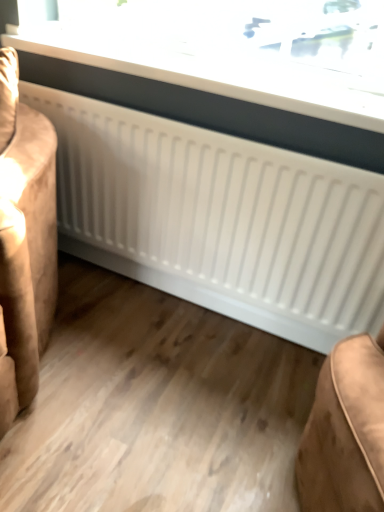
This screenshot has height=512, width=384. What do you see at coordinates (24, 242) in the screenshot?
I see `white matte radiator at lower center` at bounding box center [24, 242].

In order to click on white matte radiator at lower center in this screenshot , I will do `click(24, 242)`.

Measure the distance between point (53,273) and camera.

They are 4.65 feet apart.

Find the location of a particular element. This screenshot has width=384, height=512. white glossy radiator at upper center is located at coordinates (235, 49).

The height and width of the screenshot is (512, 384). What do you see at coordinates (235, 49) in the screenshot?
I see `white glossy radiator at upper center` at bounding box center [235, 49].

This screenshot has width=384, height=512. Identify the location of white matte radiator at lower center. (24, 242).

Which object is positioned more to the right, white matte radiator at lower center or white glossy radiator at upper center?

From the viewer's perspective, white glossy radiator at upper center appears more on the right side.

Is white matte radiator at lower center further to camera compared to white glossy radiator at upper center?

No, it is in front of white glossy radiator at upper center.

Considering the points (17, 329) and (145, 38), which point is in front, point (17, 329) or point (145, 38)?

The point (17, 329) is in front.

Looking at this image, from the image's perspective, which one is positioned higher, white matte radiator at lower center or white glossy radiator at upper center?

white glossy radiator at upper center, from the image's perspective.

From a real-world perspective, is white matte radiator at lower center under white glossy radiator at upper center?

Indeed, from a real-world perspective, white matte radiator at lower center is positioned beneath white glossy radiator at upper center.

Considering the sizes of objects white matte radiator at lower center and white glossy radiator at upper center in the image provided, who is thinner, white matte radiator at lower center or white glossy radiator at upper center?

white glossy radiator at upper center.

From the picture: Considering the relative sizes of white matte radiator at lower center and white glossy radiator at upper center in the image provided, is white matte radiator at lower center taller than white glossy radiator at upper center?

Yes.

In the scene shown: Based on their sizes in the image, would you say white matte radiator at lower center is bigger or smaller than white glossy radiator at upper center?

In the image, white matte radiator at lower center appears to be larger than white glossy radiator at upper center.

Is white matte radiator at lower center positioned beyond the bounds of white glossy radiator at upper center?

That's correct, white matte radiator at lower center is outside of white glossy radiator at upper center.

Can you see white matte radiator at lower center touching white glossy radiator at upper center?

No, white matte radiator at lower center is not in contact with white glossy radiator at upper center.

Is white matte radiator at lower center aimed at white glossy radiator at upper center?

No, white matte radiator at lower center is not aimed at white glossy radiator at upper center.

From the picture: Can you tell me how much white matte radiator at lower center and white glossy radiator at upper center differ in facing direction?

22.2 degrees separate the facing orientations of white matte radiator at lower center and white glossy radiator at upper center.

How distant is white matte radiator at lower center from white glossy radiator at upper center?

white matte radiator at lower center is 25.59 inches from white glossy radiator at upper center.

In the image, there is a white glossy radiator at upper center. Identify the location of furniture below it (from the image's perspective). (24, 242).

Which is more to the left, white glossy radiator at upper center or white matte radiator at lower center?

Positioned to the left is white matte radiator at lower center.

Does white glossy radiator at upper center lie in front of white matte radiator at lower center?

No, it is behind white matte radiator at lower center.

Is point (370, 42) in front of point (33, 368)?

No, (370, 42) is behind (33, 368).

From the image's perspective, which is below, white glossy radiator at upper center or white matte radiator at lower center?

white matte radiator at lower center, from the image's perspective.

From a real-world perspective, is white glossy radiator at upper center located higher than white matte radiator at lower center?

Yes, from a real-world perspective, white glossy radiator at upper center is over white matte radiator at lower center

Does white glossy radiator at upper center have a lesser width compared to white matte radiator at lower center?

Indeed, white glossy radiator at upper center has a lesser width compared to white matte radiator at lower center.

Is white glossy radiator at upper center taller or shorter than white matte radiator at lower center?

Clearly, white glossy radiator at upper center is shorter compared to white matte radiator at lower center.

Based on the photo, between white glossy radiator at upper center and white matte radiator at lower center, which one has smaller size?

white glossy radiator at upper center.

Would you say white glossy radiator at upper center is inside or outside white matte radiator at lower center?

white glossy radiator at upper center is not inside white matte radiator at lower center, it's outside.

Is white glossy radiator at upper center not close to white matte radiator at lower center?

No.

Is white matte radiator at lower center at the back of white glossy radiator at upper center?

That's not correct — white glossy radiator at upper center is not looking away from white matte radiator at lower center.

What's the angular difference between white glossy radiator at upper center and white matte radiator at lower center's facing directions?

The facing directions of white glossy radiator at upper center and white matte radiator at lower center are 22.2 degrees apart.

You are a GUI agent. You are given a task and a screenshot of the screen. Output one action in this format:
    pyautogui.click(x=<x>, y=<y>)
    Task: Click on the window behind the white matte radiator at lower center
    The width and height of the screenshot is (384, 512).
    Given the screenshot: What is the action you would take?
    [235, 49]

Where is `window behind the white matte radiator at lower center`? The height and width of the screenshot is (512, 384). window behind the white matte radiator at lower center is located at coordinates (235, 49).

The image size is (384, 512). Find the location of `window above the white matte radiator at lower center (from a real-world perspective)`. window above the white matte radiator at lower center (from a real-world perspective) is located at coordinates (235, 49).